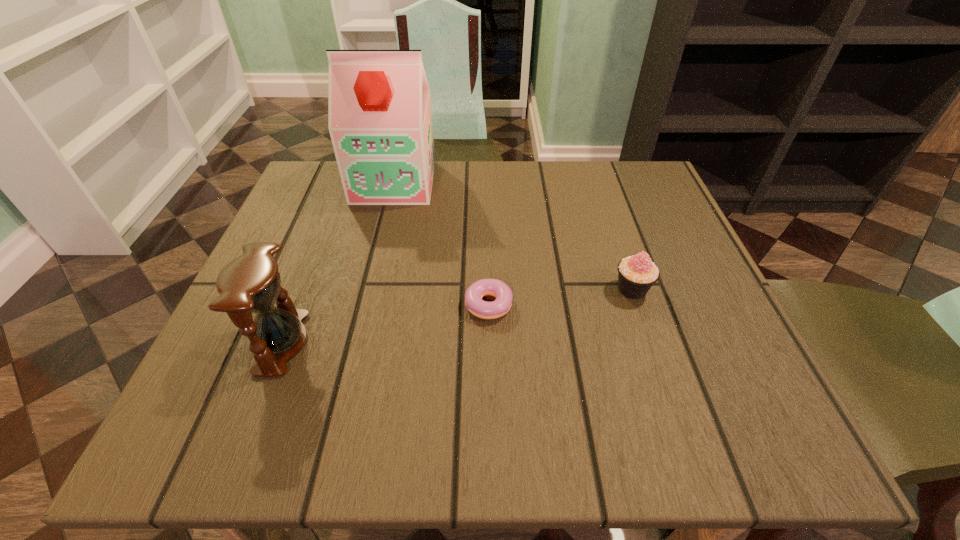
Where is `vacant area situated on the left of the doughnut`? vacant area situated on the left of the doughnut is located at coordinates (291, 305).

Find the location of `object that is at the far edge`. object that is at the far edge is located at coordinates (379, 117).

This screenshot has height=540, width=960. I want to click on soya milk that is at the left edge, so click(379, 117).

Locate an element on the screen. Image resolution: width=960 pixels, height=540 pixels. hourglass present at the left edge is located at coordinates (251, 283).

The image size is (960, 540). Find the location of `object that is at the right edge`. object that is at the right edge is located at coordinates (636, 274).

At what (x,y) coordinates should I click in order to perform the action: click on object located at the far left corner. Please return your answer as a coordinate pair (x, y). Looking at the image, I should click on (379, 117).

Locate an element on the screen. vacant space at the far edge is located at coordinates (459, 191).

The image size is (960, 540). I want to click on vacant space at the near edge of the desktop, so click(575, 395).

This screenshot has width=960, height=540. In the image, there is a desktop. Find the location of `vacant space at the left edge`. vacant space at the left edge is located at coordinates (321, 296).

The width and height of the screenshot is (960, 540). In the image, there is a desktop. In order to click on vacant space at the right edge in this screenshot , I will do `click(696, 280)`.